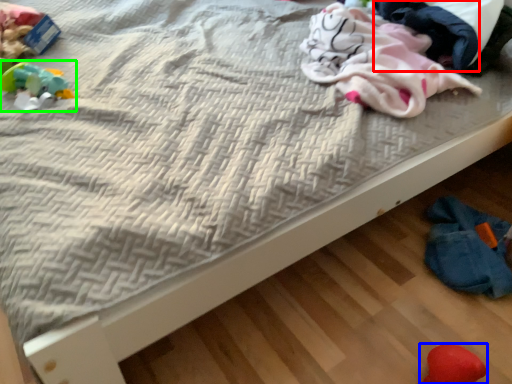
Question: Which is farther away from clothing (highlighted by a red box)? toy (highlighted by a blue box) or toy (highlighted by a green box)?

Choices:
 (A) toy
 (B) toy

Answer: (B)